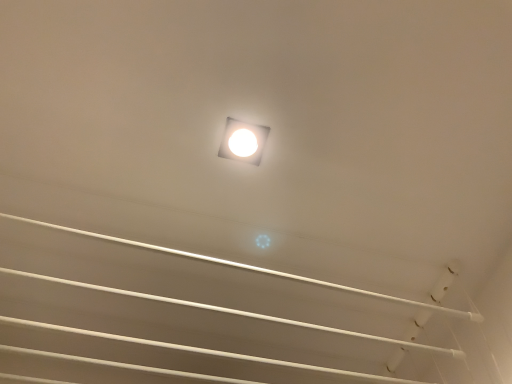
Question: Based on their sizes in the image, would you say white glossy square at center is bigger or smaller than white glossy ceiling at upper center?

Choices:
 (A) big
 (B) small

Answer: (B)

Question: From the image's perspective, relative to white glossy ceiling at upper center, is white glossy square at center above or below?

Choices:
 (A) above
 (B) below

Answer: (A)

Question: Is white glossy square at center inside or outside of white glossy ceiling at upper center?

Choices:
 (A) outside
 (B) inside

Answer: (A)

Question: Looking at their shapes, would you say white glossy ceiling at upper center is wider or thinner than white glossy square at center?

Choices:
 (A) thin
 (B) wide

Answer: (B)

Question: Is white glossy ceiling at upper center to the left or to the right of white glossy square at center in the image?

Choices:
 (A) right
 (B) left

Answer: (B)

Question: In the image, is white glossy ceiling at upper center positioned in front of or behind white glossy square at center?

Choices:
 (A) front
 (B) behind

Answer: (A)

Question: Considering the positions of white glossy ceiling at upper center and white glossy square at center in the image, is white glossy ceiling at upper center taller or shorter than white glossy square at center?

Choices:
 (A) short
 (B) tall

Answer: (B)